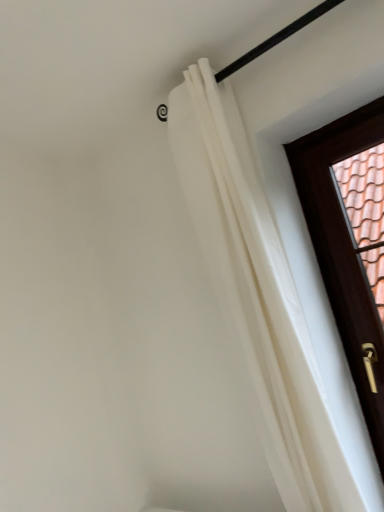
In order to face brown wooden door at right, should I rotate leftwards or rightwards?

Turn right approximately 24.467 degrees to face it.

What is the approximate height of brown wooden door at right?

brown wooden door at right is 3.89 feet tall.

You are a GUI agent. You are given a task and a screenshot of the screen. Output one action in this format:
    pyautogui.click(x=<x>, y=<y>)
    Task: Click on the brown wooden door at right
    This screenshot has width=384, height=512.
    Given the screenshot: What is the action you would take?
    pyautogui.click(x=349, y=244)

The height and width of the screenshot is (512, 384). Describe the element at coordinates (349, 244) in the screenshot. I see `brown wooden door at right` at that location.

The width and height of the screenshot is (384, 512). Find the location of `white sheer curtain at upper right`. white sheer curtain at upper right is located at coordinates (259, 298).

Describe the element at coordinates (259, 298) in the screenshot. I see `white sheer curtain at upper right` at that location.

Identify the location of brown wooden door at right. (349, 244).

Would you say white sheer curtain at upper right is to the left or to the right of brown wooden door at right in the picture?

In the image, white sheer curtain at upper right appears on the left side of brown wooden door at right.

Is white sheer curtain at upper right further to camera compared to brown wooden door at right?

No, white sheer curtain at upper right is closer to the viewer.

Between point (174, 93) and point (377, 428), which one is positioned in front?

Positioned in front is point (377, 428).

From the image's perspective, relative to brown wooden door at right, is white sheer curtain at upper right above or below?

Clearly, from the image's perspective, white sheer curtain at upper right is above brown wooden door at right.

From a real-world perspective, between white sheer curtain at upper right and brown wooden door at right, who is vertically higher?

white sheer curtain at upper right.

Which of these two, white sheer curtain at upper right or brown wooden door at right, is wider?

Wider between the two is white sheer curtain at upper right.

Considering the sizes of white sheer curtain at upper right and brown wooden door at right in the image, is white sheer curtain at upper right taller or shorter than brown wooden door at right?

Clearly, white sheer curtain at upper right is taller compared to brown wooden door at right.

Between white sheer curtain at upper right and brown wooden door at right, which one has smaller size?

Smaller between the two is brown wooden door at right.

Is white sheer curtain at upper right positioned beyond the bounds of brown wooden door at right?

Yes.

Are white sheer curtain at upper right and brown wooden door at right beside each other?

white sheer curtain at upper right and brown wooden door at right are not in contact.

Is white sheer curtain at upper right facing away from brown wooden door at right?

No, white sheer curtain at upper right is not facing away from brown wooden door at right.

Where is `door located below the white sheer curtain at upper right (from the image's perspective)`? This screenshot has height=512, width=384. door located below the white sheer curtain at upper right (from the image's perspective) is located at coordinates (349, 244).

Considering the positions of objects brown wooden door at right and white sheer curtain at upper right in the image provided, who is more to the right, brown wooden door at right or white sheer curtain at upper right?

From the viewer's perspective, brown wooden door at right appears more on the right side.

Is the depth of brown wooden door at right less than that of white sheer curtain at upper right?

No, it is behind white sheer curtain at upper right.

Between point (364, 394) and point (335, 494), which one is positioned in front?

Positioned in front is point (335, 494).

From the image's perspective, would you say brown wooden door at right is shown under white sheer curtain at upper right?

Yes, from the image's perspective, brown wooden door at right is below white sheer curtain at upper right.

From a real-world perspective, is brown wooden door at right located beneath white sheer curtain at upper right?

Yes, from a real-world perspective, brown wooden door at right is below white sheer curtain at upper right.

Consider the image. Considering the sizes of objects brown wooden door at right and white sheer curtain at upper right in the image provided, who is wider, brown wooden door at right or white sheer curtain at upper right?

Wider between the two is white sheer curtain at upper right.

Considering the relative sizes of brown wooden door at right and white sheer curtain at upper right in the image provided, is brown wooden door at right shorter than white sheer curtain at upper right?

Indeed, brown wooden door at right has a lesser height compared to white sheer curtain at upper right.

Is brown wooden door at right smaller than white sheer curtain at upper right?

Correct, brown wooden door at right occupies less space than white sheer curtain at upper right.

Would you say brown wooden door at right is outside white sheer curtain at upper right?

brown wooden door at right lies outside white sheer curtain at upper right's area.

In the scene shown: Is there a large distance between brown wooden door at right and white sheer curtain at upper right?

Indeed, brown wooden door at right is not near white sheer curtain at upper right.

Is white sheer curtain at upper right at the back of brown wooden door at right?

brown wooden door at right is not turned away from white sheer curtain at upper right.

What's the angular difference between brown wooden door at right and white sheer curtain at upper right's facing directions?

2.18 degrees.

Locate an element on the screen. The width and height of the screenshot is (384, 512). curtain on the left side of brown wooden door at right is located at coordinates (259, 298).

Find the location of a particular element. curtain lying in front of the brown wooden door at right is located at coordinates (259, 298).

At what (x,y) coordinates should I click in order to perform the action: click on door behind the white sheer curtain at upper right. Please return your answer as a coordinate pair (x, y). Looking at the image, I should click on (349, 244).